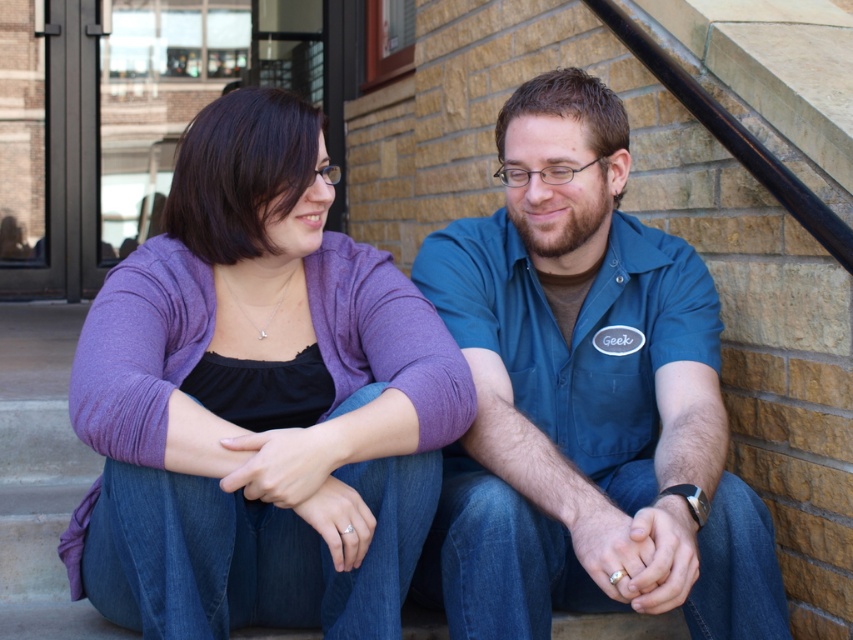
Question: Can you confirm if purple soft sweater at center is thinner than blue cotton shirt at center?

Choices:
 (A) yes
 (B) no

Answer: (B)

Question: Is purple soft sweater at center wider than blue cotton shirt at center?

Choices:
 (A) yes
 (B) no

Answer: (A)

Question: In this image, where is purple soft sweater at center located relative to blue cotton shirt at center?

Choices:
 (A) left
 (B) right

Answer: (A)

Question: Among these objects, which one is nearest to the camera?

Choices:
 (A) blue cotton shirt at center
 (B) purple soft sweater at center

Answer: (B)

Question: Which object appears farthest from the camera in this image?

Choices:
 (A) purple soft sweater at center
 (B) blue cotton shirt at center

Answer: (B)

Question: Which of the following is the farthest from the observer?

Choices:
 (A) blue cotton shirt at center
 (B) purple soft sweater at center

Answer: (A)